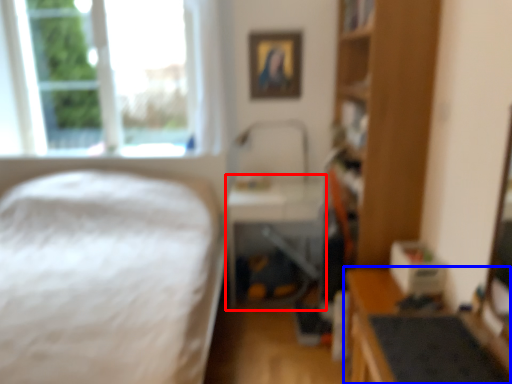
Question: Which object appears farthest to the camera in this image, table (highlighted by a red box) or workbench (highlighted by a blue box)?

Choices:
 (A) table
 (B) workbench

Answer: (A)